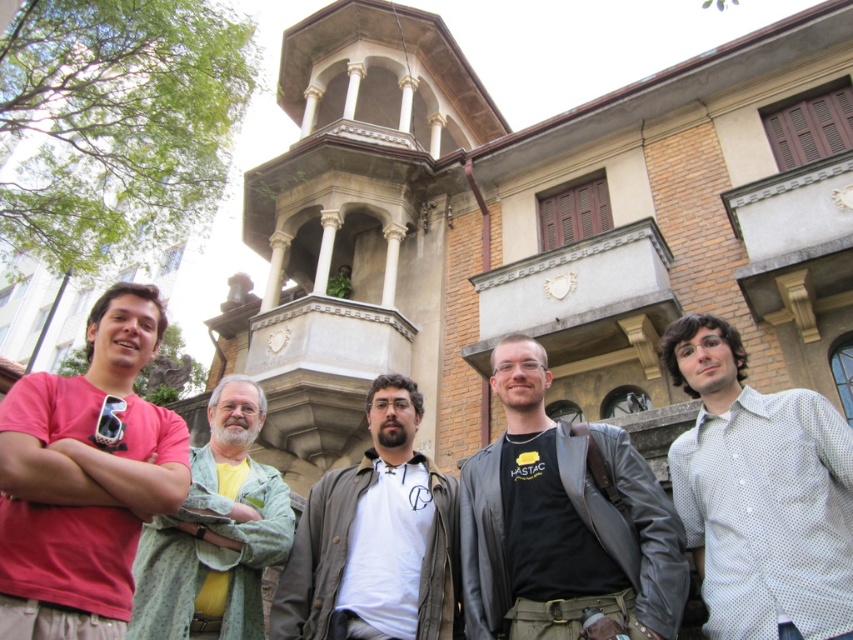
Is white dotted shirt at right bigger than white matte shirt at center?

Yes, white dotted shirt at right is bigger than white matte shirt at center.

Does white dotted shirt at right appear on the right side of white matte shirt at center?

Correct, you'll find white dotted shirt at right to the right of white matte shirt at center.

Is point (682, 448) farther from viewer compared to point (403, 461)?

That is False.

At what (x,y) coordinates should I click in order to perform the action: click on white dotted shirt at right. Please return your answer as a coordinate pair (x, y). This screenshot has width=853, height=640. Looking at the image, I should click on (759, 493).

Does matte pink shirt at center appear on the left side of black leather jacket at center?

Indeed, matte pink shirt at center is positioned on the left side of black leather jacket at center.

Can you confirm if matte pink shirt at center is positioned above black leather jacket at center?

Indeed, matte pink shirt at center is positioned over black leather jacket at center.

Locate an element on the screen. Image resolution: width=853 pixels, height=640 pixels. matte pink shirt at center is located at coordinates (85, 477).

Is point (3, 412) closer to camera compared to point (326, 476)?

Yes, it is in front of point (326, 476).

Is matte pink shirt at center to the left of white matte shirt at center from the viewer's perspective?

Indeed, matte pink shirt at center is positioned on the left side of white matte shirt at center.

In order to click on matte pink shirt at center in this screenshot , I will do `click(85, 477)`.